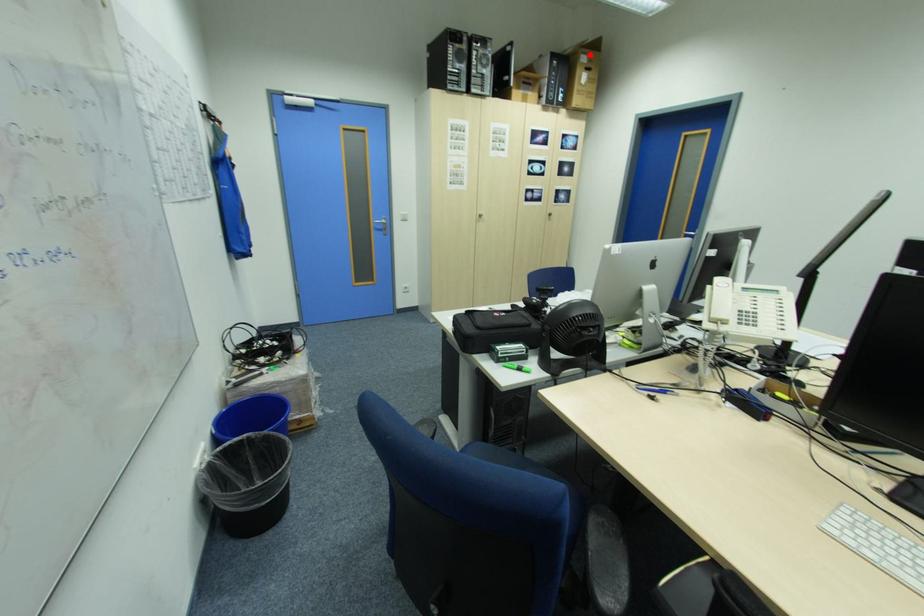
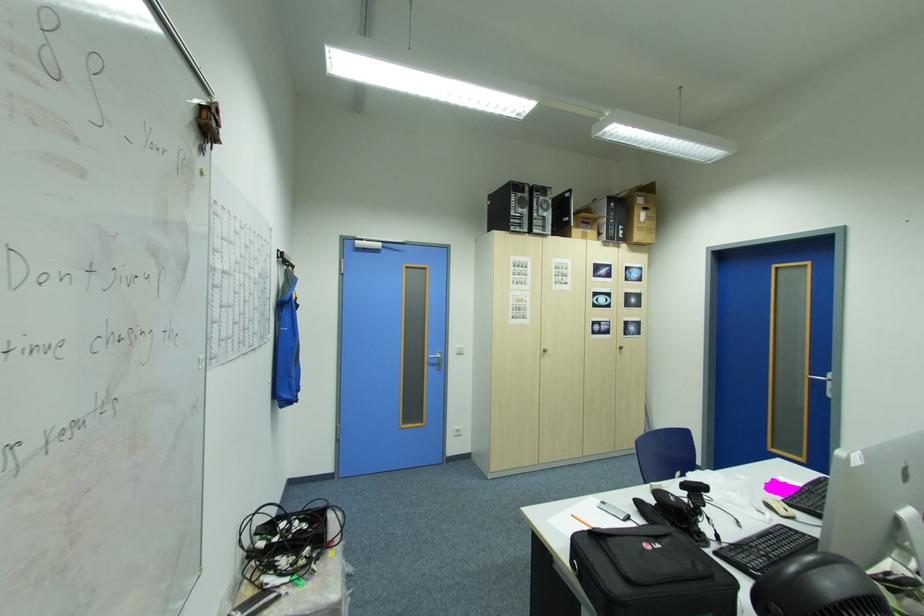
Locate, in the second image, the point that corresponds to the highlighted location in the first image.

(648, 198)